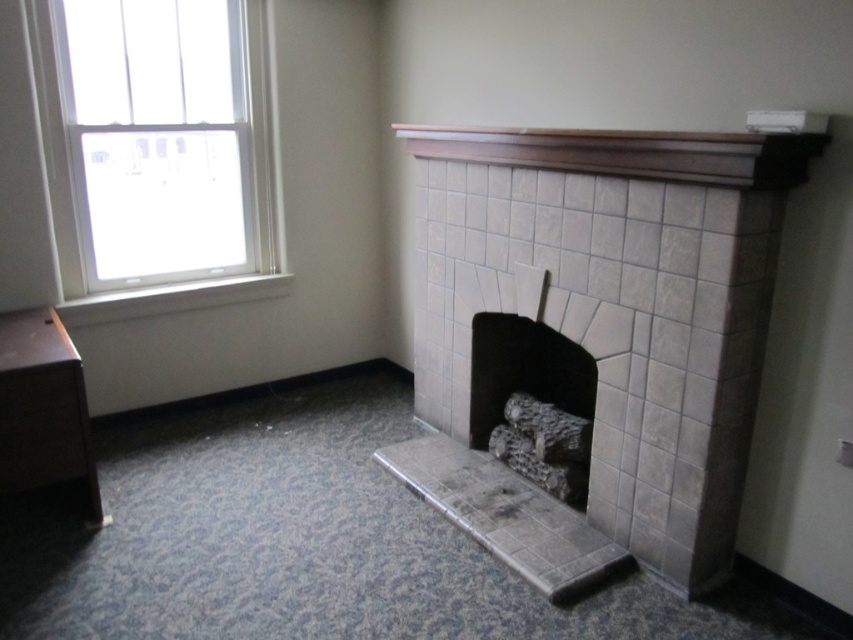
Question: Does white glass window at upper left have a lesser width compared to brown wood mantle at upper center?

Choices:
 (A) no
 (B) yes

Answer: (B)

Question: Does white glass window at upper left appear under gray stone fireplace at center?

Choices:
 (A) yes
 (B) no

Answer: (B)

Question: Among these points, which one is nearest to the camera?

Choices:
 (A) (x=495, y=312)
 (B) (x=138, y=257)

Answer: (A)

Question: Is white glass window at upper left wider than gray stone fireplace at center?

Choices:
 (A) no
 (B) yes

Answer: (B)

Question: Which point is farther to the camera?

Choices:
 (A) (456, 170)
 (B) (486, 372)
 (C) (277, 257)

Answer: (C)

Question: Which point is closer to the camera taking this photo?

Choices:
 (A) (697, 317)
 (B) (28, 36)

Answer: (A)